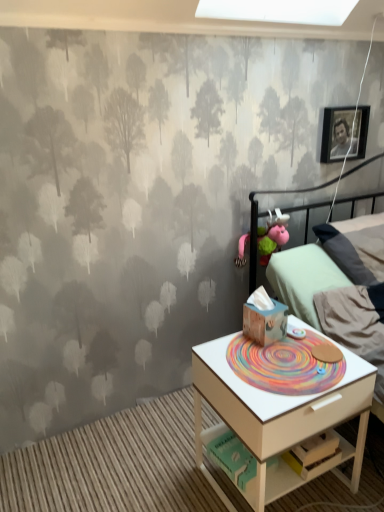
Identify the location of free space to the left of white wood nightstand at lower right. The image size is (384, 512). (162, 466).